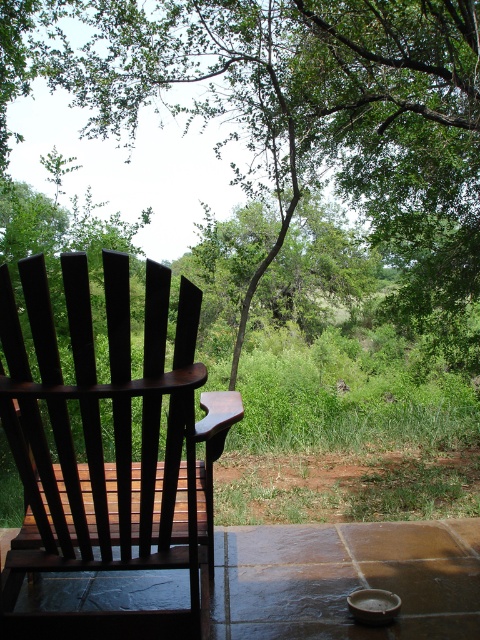
Question: Can you confirm if green leafy tree at upper center is positioned below dark wood rocking chair at left?

Choices:
 (A) yes
 (B) no

Answer: (B)

Question: Which of these objects is positioned farthest from the green leafy tree at upper center?

Choices:
 (A) dark wood rocking chair at left
 (B) smooth stone porch at lower center

Answer: (A)

Question: Estimate the real-world distances between objects in this image. Which object is farther from the smooth stone porch at lower center?

Choices:
 (A) dark wood rocking chair at left
 (B) green leafy tree at upper center

Answer: (B)

Question: Is dark wood rocking chair at left closer to the viewer compared to smooth stone porch at lower center?

Choices:
 (A) no
 (B) yes

Answer: (B)

Question: Among these objects, which one is nearest to the camera?

Choices:
 (A) dark wood rocking chair at left
 (B) green leafy tree at upper center
 (C) smooth stone porch at lower center

Answer: (A)

Question: Does green leafy tree at upper center have a lesser width compared to dark wood rocking chair at left?

Choices:
 (A) yes
 (B) no

Answer: (B)